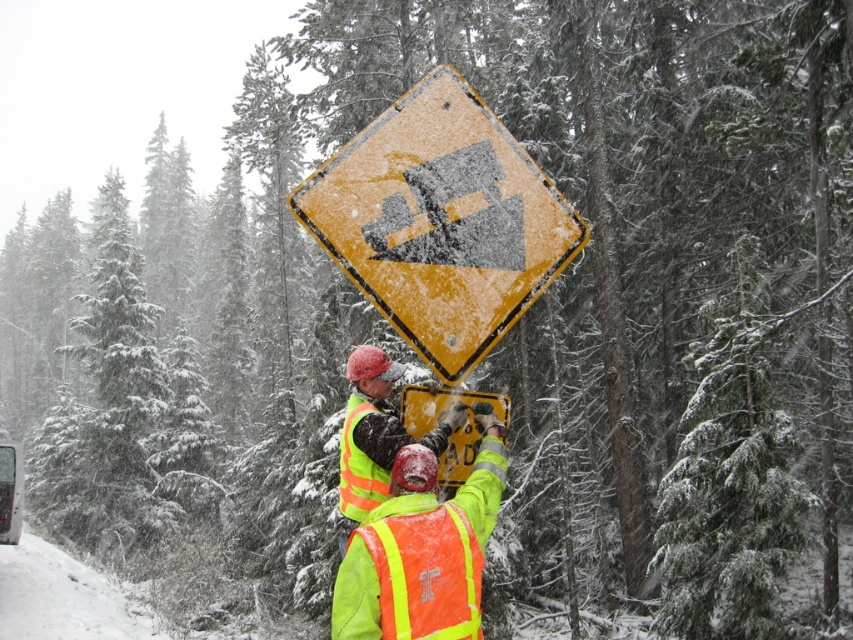
Is point (421, 125) farther from viewer compared to point (474, 566)?

Yes, it is behind point (474, 566).

Can you confirm if yellow reflective diamond at center is thinner than high-visibility reflective vest at center?

Incorrect, yellow reflective diamond at center's width is not less than high-visibility reflective vest at center's.

What do you see at coordinates (440, 221) in the screenshot? Image resolution: width=853 pixels, height=640 pixels. I see `yellow reflective diamond at center` at bounding box center [440, 221].

Locate an element on the screen. This screenshot has height=640, width=853. yellow reflective diamond at center is located at coordinates (440, 221).

Does point (471, 540) lie behind point (364, 474)?

That is False.

Which is more to the right, high-visibility reflective safety vest at center or high visibility yellow-green safety vest at center?

high-visibility reflective safety vest at center is more to the right.

Who is more distant from viewer, (431, 588) or (375, 496)?

The point (375, 496) is more distant.

Where is `high-visibility reflective safety vest at center`? This screenshot has height=640, width=853. high-visibility reflective safety vest at center is located at coordinates (426, 573).

Does yellow reflective diamond at center appear on the left side of high visibility yellow-green safety vest at center?

Incorrect, yellow reflective diamond at center is not on the left side of high visibility yellow-green safety vest at center.

Describe the element at coordinates (440, 221) in the screenshot. I see `yellow reflective diamond at center` at that location.

Is point (378, 268) behind point (349, 477)?

No, (378, 268) is in front of (349, 477).

Find the location of `yellow reflective diamond at center`. yellow reflective diamond at center is located at coordinates (440, 221).